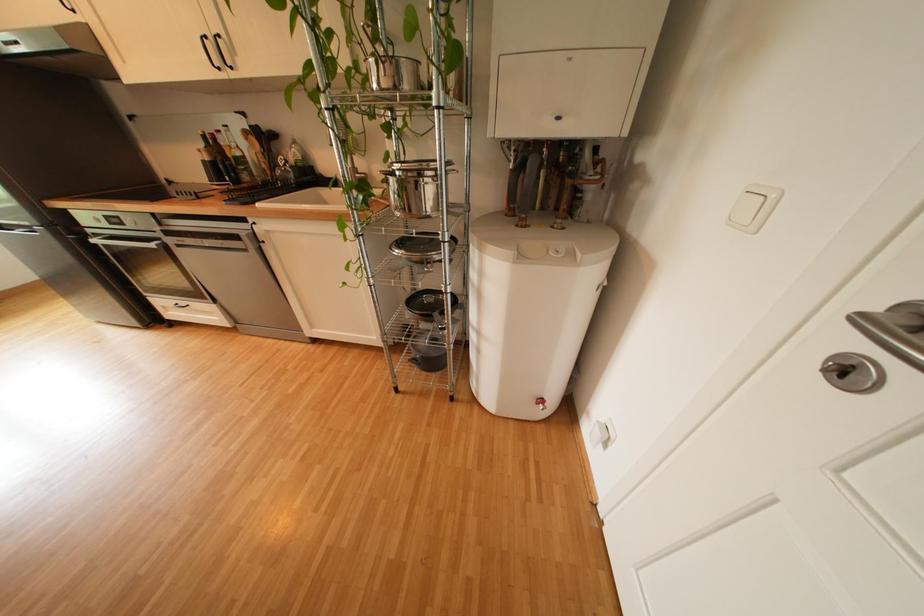
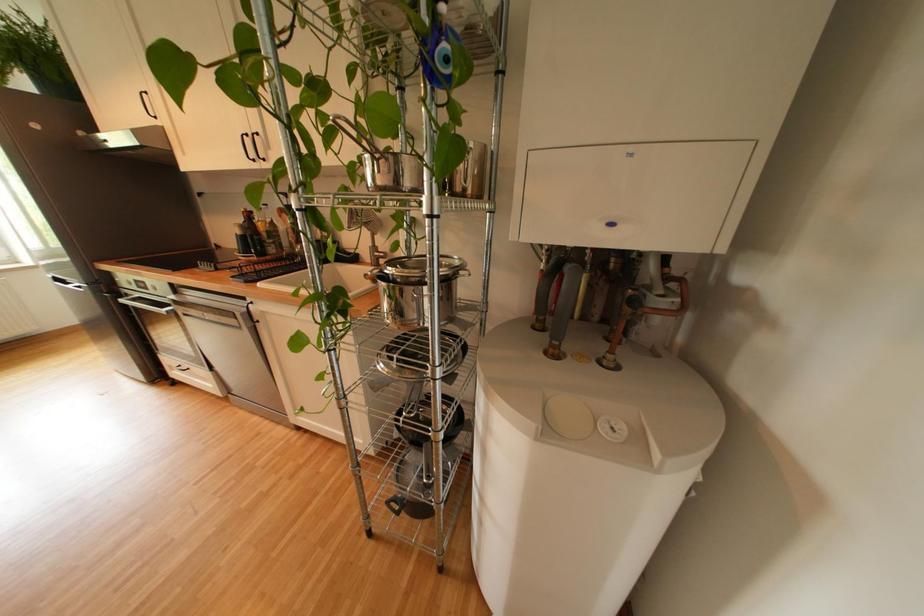
Question: The images are taken continuously from a first-person perspective. In which direction is your viewpoint rotating?

Choices:
 (A) Left
 (B) Right
 (C) Up
 (D) Down

Answer: (C)